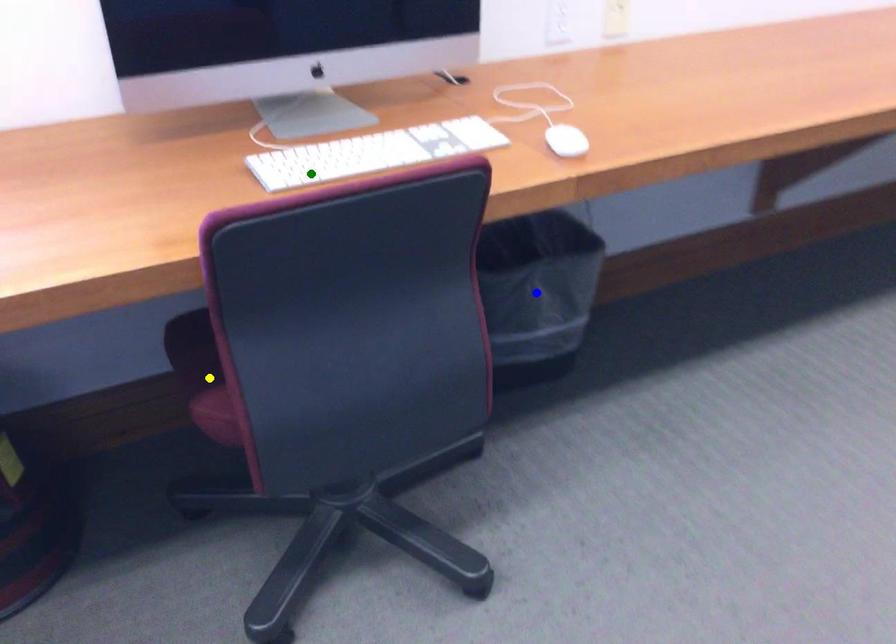
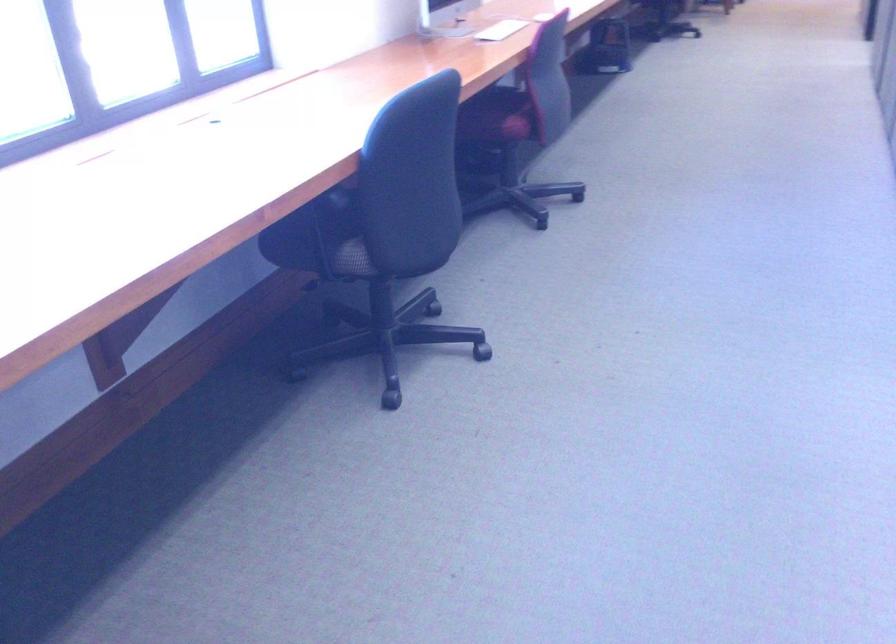
I am providing you with two images of the same scene from different viewpoints. Three points are marked in image1. Which point corresponds to a part or object that is occluded in image2?In image1, three points are marked. Which of them correspond to a part or object that is occluded in image2?Among the three points shown in image1, which one corresponds to a part or object that is no longer visible due to occlusion in image2?

blue point cannot be seen in image2.